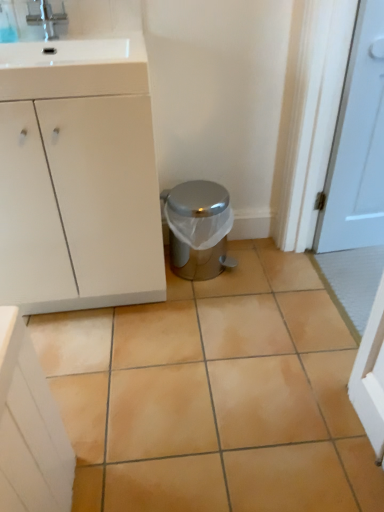
This screenshot has height=512, width=384. In order to click on white glossy sink at upper left in this screenshot , I will do `click(73, 80)`.

Where is `beige ceramic tile at center`? The width and height of the screenshot is (384, 512). beige ceramic tile at center is located at coordinates (214, 395).

What's the angular difference between beige ceramic tile at center and satin silver trash can at center's facing directions?

89.3 degrees separate the facing orientations of beige ceramic tile at center and satin silver trash can at center.

From a real-world perspective, is beige ceramic tile at center under satin silver trash can at center?

Yes, from a real-world perspective, beige ceramic tile at center is below satin silver trash can at center.

Is beige ceramic tile at center shorter than satin silver trash can at center?

Yes, beige ceramic tile at center is shorter than satin silver trash can at center.

Is beige ceramic tile at center far from satin silver trash can at center?

beige ceramic tile at center is near satin silver trash can at center, not far away.

Based on their sizes in the image, would you say white glossy sink at upper left is bigger or smaller than satin silver trash can at center?

In the image, white glossy sink at upper left appears to be smaller than satin silver trash can at center.

Is white glossy sink at upper left behind satin silver trash can at center?

That is False.

Who is shorter, white glossy sink at upper left or satin silver trash can at center?

white glossy sink at upper left is shorter.

Between white glossy sink at upper left and satin silver trash can at center, which one appears on the right side from the viewer's perspective?

satin silver trash can at center is more to the right.

How distant is brushed metal faucet at upper left from beige ceramic tile at center?

brushed metal faucet at upper left and beige ceramic tile at center are 4.01 feet apart from each other.

Is brushed metal faucet at upper left bigger or smaller than beige ceramic tile at center?

Considering their sizes, brushed metal faucet at upper left takes up less space than beige ceramic tile at center.

Which object is closer to the camera, brushed metal faucet at upper left or beige ceramic tile at center?

beige ceramic tile at center is in front.

Could you tell me if brushed metal faucet at upper left is turned towards beige ceramic tile at center?

No, brushed metal faucet at upper left is not facing towards beige ceramic tile at center.

Based on the photo, which is in front, white matte cabinet at left or satin silver trash can at center?

white matte cabinet at left is in front.

From their relative heights in the image, would you say white matte cabinet at left is taller or shorter than satin silver trash can at center?

Considering their sizes, white matte cabinet at left has more height than satin silver trash can at center.

From a real-world perspective, is white matte cabinet at left under satin silver trash can at center?

No, from a real-world perspective, white matte cabinet at left is not below satin silver trash can at center.

Image resolution: width=384 pixels, height=512 pixels. I want to click on ceramic tile located below the brushed metal faucet at upper left (from the image's perspective), so click(x=214, y=395).

From a real-world perspective, is beige ceramic tile at center physically above brushed metal faucet at upper left?

Actually, beige ceramic tile at center is physically below brushed metal faucet at upper left in the real world.

Between beige ceramic tile at center and brushed metal faucet at upper left, which one appears on the left side from the viewer's perspective?

From the viewer's perspective, brushed metal faucet at upper left appears more on the left side.

How different are the orientations of beige ceramic tile at center and brushed metal faucet at upper left in degrees?

89.3 degrees separate the facing orientations of beige ceramic tile at center and brushed metal faucet at upper left.

Is point (137, 87) closer or farther from the camera than point (35, 20)?

Point (137, 87) appears to be closer to the viewer than point (35, 20).

Is white glossy sink at upper left inside the boundaries of brushed metal faucet at upper left, or outside?

white glossy sink at upper left is located beyond the bounds of brushed metal faucet at upper left.

How different are the orientations of white glossy sink at upper left and brushed metal faucet at upper left in degrees?

The angular difference between white glossy sink at upper left and brushed metal faucet at upper left is 0.00101 degrees.

Considering the relative sizes of white glossy sink at upper left and brushed metal faucet at upper left in the image provided, is white glossy sink at upper left thinner than brushed metal faucet at upper left?

No.

Does white glossy sink at upper left have a greater width compared to beige ceramic tile at center?

No, white glossy sink at upper left is not wider than beige ceramic tile at center.

Locate an element on the screen. ceramic tile in front of the white glossy sink at upper left is located at coordinates (214, 395).

Who is smaller, white glossy sink at upper left or beige ceramic tile at center?

white glossy sink at upper left.

In the image, there is a satin silver trash can at center. Where is `ceramic tile below it (from a real-world perspective)`? This screenshot has width=384, height=512. ceramic tile below it (from a real-world perspective) is located at coordinates (214, 395).

Identify the location of potty behind the white glossy sink at upper left. The image size is (384, 512). (197, 227).

Looking at the image, which one is located closer to white matte cabinet at left, white glossy sink at upper left or beige ceramic tile at center?

Based on the image, white glossy sink at upper left appears to be nearer to white matte cabinet at left.

Looking at the image, which one is located closer to white matte cabinet at left, satin silver trash can at center or brushed metal faucet at upper left?

satin silver trash can at center.

Which object lies further to the anchor point satin silver trash can at center, white matte cabinet at left or brushed metal faucet at upper left?

brushed metal faucet at upper left is further to satin silver trash can at center.

From the image, which object appears to be nearer to beige ceramic tile at center, white glossy sink at upper left or white matte cabinet at left?

white matte cabinet at left lies closer to beige ceramic tile at center than the other object.

Consider the image. Considering their positions, is satin silver trash can at center positioned further to beige ceramic tile at center than white glossy sink at upper left?

white glossy sink at upper left.

Based on their spatial positions, is satin silver trash can at center or white glossy sink at upper left further from brushed metal faucet at upper left?

satin silver trash can at center is further to brushed metal faucet at upper left.

Considering their positions, is white glossy sink at upper left positioned closer to white matte cabinet at left than brushed metal faucet at upper left?

white glossy sink at upper left.

From the image, which object appears to be nearer to white matte cabinet at left, beige ceramic tile at center or white glossy sink at upper left?

Answer: white glossy sink at upper left lies closer to white matte cabinet at left than the other object.

Find the location of a particular element. bathroom cabinet between brushed metal faucet at upper left and satin silver trash can at center vertically is located at coordinates (79, 168).

The height and width of the screenshot is (512, 384). Find the location of `drawer between brushed metal faucet at upper left and beige ceramic tile at center from top to bottom`. drawer between brushed metal faucet at upper left and beige ceramic tile at center from top to bottom is located at coordinates (73, 80).

Identify the location of potty between brushed metal faucet at upper left and beige ceramic tile at center in the up-down direction. (197, 227).

Identify the location of bathroom cabinet located between beige ceramic tile at center and satin silver trash can at center in the depth direction. Image resolution: width=384 pixels, height=512 pixels. (79, 168).